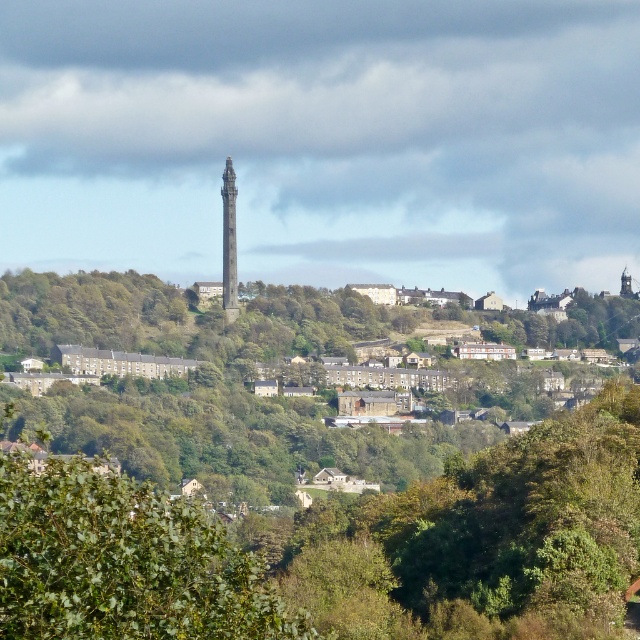
Question: Observing the image, what is the correct spatial positioning of brown stone houses at center in reference to smooth stone tower at center?

Choices:
 (A) above
 (B) below

Answer: (B)

Question: Among these objects, which one is nearest to the camera?

Choices:
 (A) smooth stone tower at center
 (B) brown stone houses at center

Answer: (B)

Question: Which point appears farthest from the camera in this image?

Choices:
 (A) (237, 308)
 (B) (152, 394)

Answer: (B)

Question: Can you confirm if brown stone houses at center is thinner than smooth stone tower at center?

Choices:
 (A) no
 (B) yes

Answer: (A)

Question: Is brown stone houses at center to the right of smooth stone tower at center from the viewer's perspective?

Choices:
 (A) yes
 (B) no

Answer: (A)